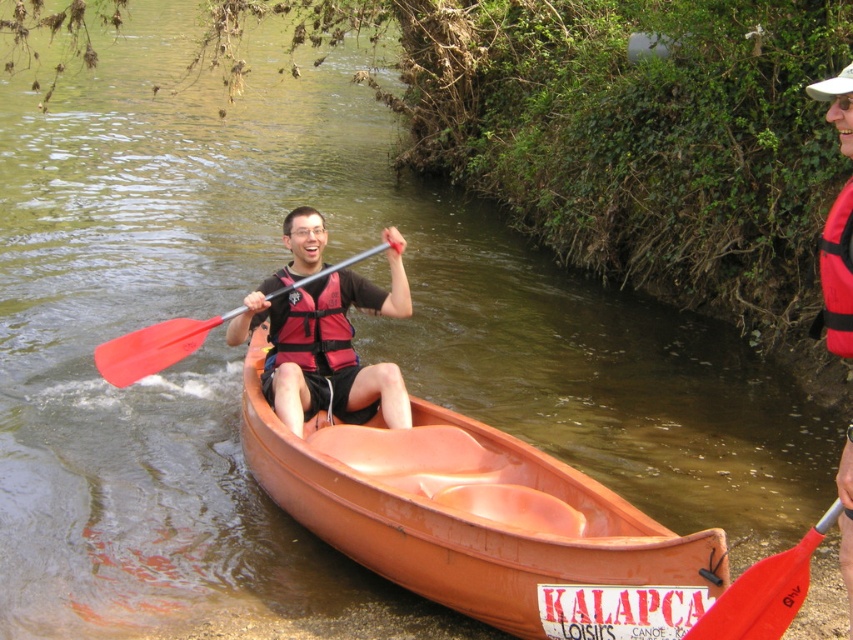
Is matte red life vest at center wider than red matte life jacket at center?

Yes.

Identify the location of matte red life vest at center. This screenshot has width=853, height=640. (325, 333).

Is orange plastic canoe at center shorter than red rubber paddle at lower right?

No.

Is point (477, 524) farther from viewer compared to point (802, 557)?

Yes, point (477, 524) is behind point (802, 557).

The image size is (853, 640). I want to click on orange plastic canoe at center, so click(x=480, y=522).

At what (x,y) coordinates should I click in order to perform the action: click on orange plastic canoe at center. Please return your answer as a coordinate pair (x, y). The height and width of the screenshot is (640, 853). Looking at the image, I should click on (480, 522).

Who is more forward, (310, 324) or (836, 298)?

Point (836, 298)

Measure the distance between point (289, 356) and camera.

The distance of point (289, 356) from camera is 7.05 meters.

The width and height of the screenshot is (853, 640). Describe the element at coordinates (312, 332) in the screenshot. I see `red matte life jacket at center` at that location.

Locate an element on the screen. red matte life jacket at center is located at coordinates pyautogui.click(x=312, y=332).